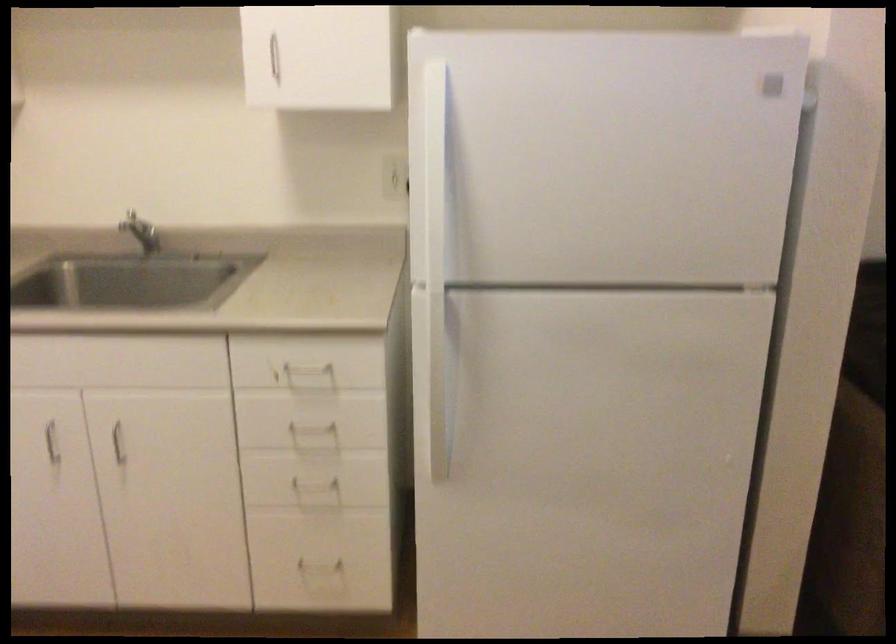
Locate an element on the screen. white refrigerator handle is located at coordinates (435, 261).